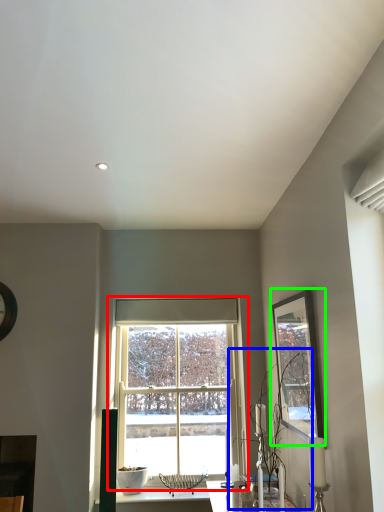
Question: Considering the real-world distances, which object is closest to window (highlighted by a red box)? plant (highlighted by a blue box) or picture frame (highlighted by a green box).

Choices:
 (A) plant
 (B) picture frame

Answer: (A)